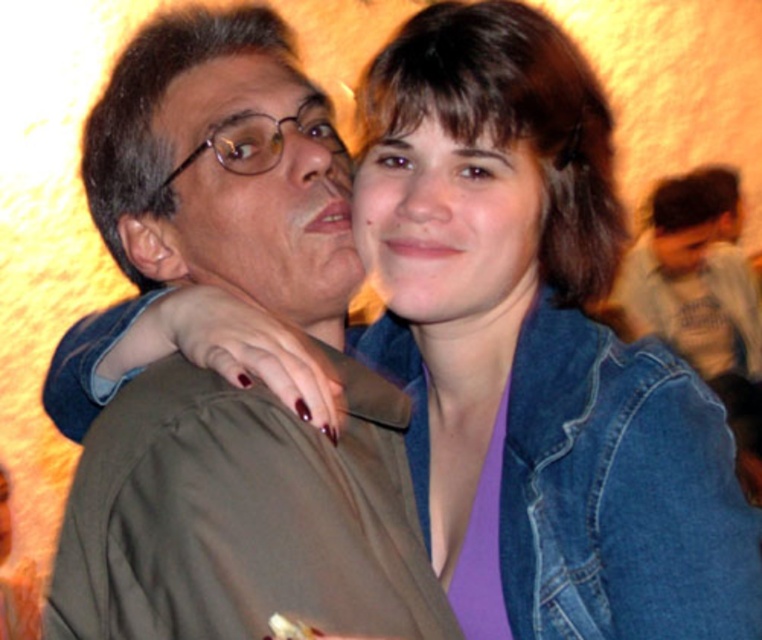
You are standing in front of the image and want to determine which of the two points, point (x=751, y=547) or point (x=245, y=122), is nearer to you. Based on the scene description, which point is closer?

Point (x=751, y=547) is closer to the viewer than point (x=245, y=122).